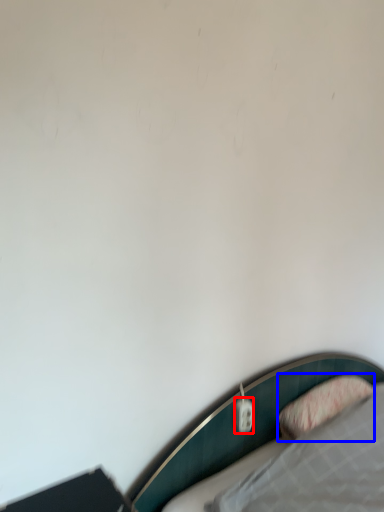
Question: Which object appears farthest to the camera in this image, electric outlet (highlighted by a red box) or pillow (highlighted by a blue box)?

Choices:
 (A) electric outlet
 (B) pillow

Answer: (A)